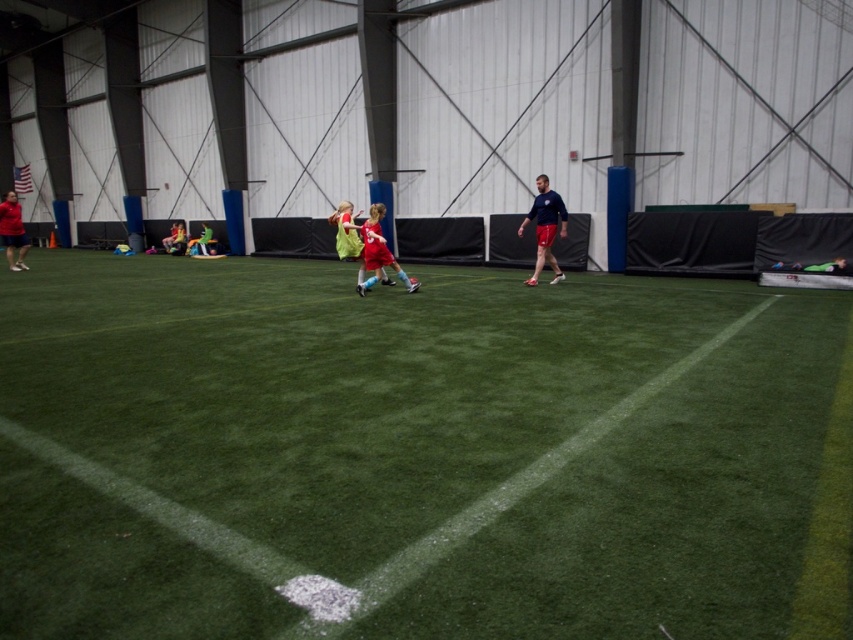
Question: Does shiny red shorts at center appear on the left side of green fabric jacket at center?

Choices:
 (A) no
 (B) yes

Answer: (A)

Question: Among these objects, which one is farthest from the camera?

Choices:
 (A) matte red shorts at left
 (B) green fabric jacket at center

Answer: (B)

Question: Which of the following is the closest to the observer?

Choices:
 (A) green fabric jacket at center
 (B) green artificial turf at center
 (C) matte red shorts at left

Answer: (B)

Question: Which point is farther to the camera?

Choices:
 (A) dark blue jersey at center
 (B) yellow-green jersey at left
 (C) green artificial turf at center
 (D) shiny red shorts at center

Answer: (B)

Question: Can you confirm if green artificial turf at center is smaller than shiny red shorts at center?

Choices:
 (A) no
 (B) yes

Answer: (A)

Question: From the image, what is the correct spatial relationship of shiny red shorts at center in relation to green fabric jacket at center?

Choices:
 (A) left
 (B) right

Answer: (B)